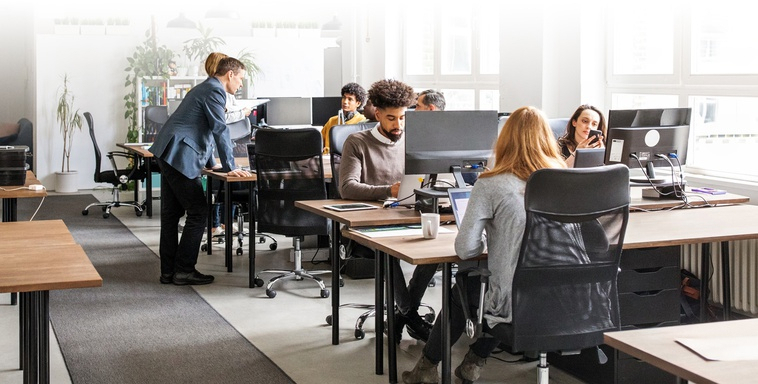
This screenshot has width=758, height=384. Identify the location of window pane. (420, 34), (461, 32), (493, 36), (489, 92), (459, 100), (418, 89), (631, 36), (719, 31), (721, 120), (647, 100).